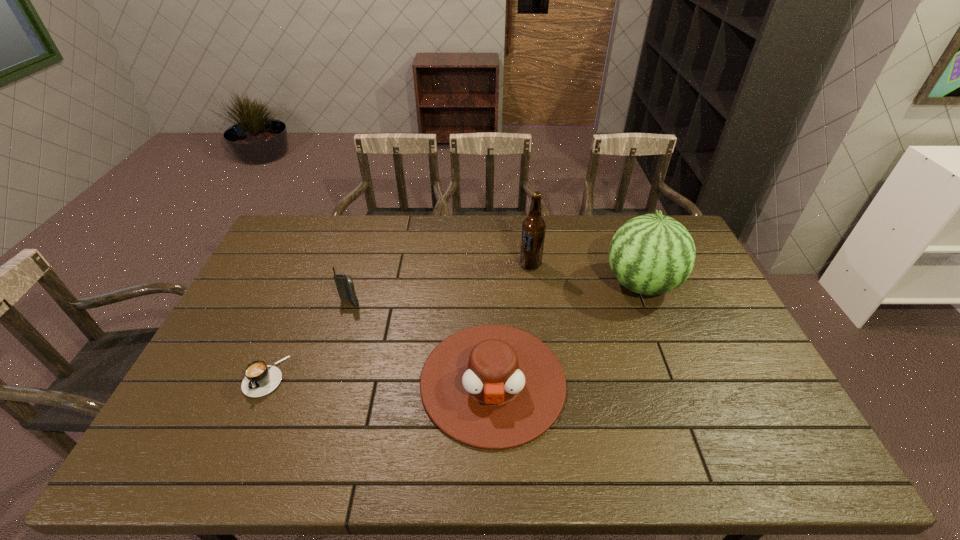
Where is `free region located 0.230m on the left of the rightmost object`? This screenshot has height=540, width=960. free region located 0.230m on the left of the rightmost object is located at coordinates (533, 285).

This screenshot has width=960, height=540. I want to click on vacant area located on the keyboard of the third shortest object, so click(x=328, y=375).

Locate an element on the screen. vacant space situated 0.110m with the handle on the side of the leftmost object is located at coordinates pos(238,439).

Where is `object that is at the near edge`? object that is at the near edge is located at coordinates (494, 387).

You are a GUI agent. You are given a task and a screenshot of the screen. Output one action in this format:
    pyautogui.click(x=<x>, y=<y>)
    Task: Click on the object positioned at the left edge
    The height and width of the screenshot is (540, 960).
    Given the screenshot: What is the action you would take?
    pyautogui.click(x=260, y=379)

Identify the location of object that is at the right edge. (652, 254).

This screenshot has height=540, width=960. In the image, there is a desktop. Find the location of `free space at the far edge`. free space at the far edge is located at coordinates (607, 230).

In the image, there is a desktop. What are the coordinates of `vacant space at the near edge` in the screenshot? It's located at (552, 446).

Where is `free space at the left edge of the desktop`? This screenshot has width=960, height=540. free space at the left edge of the desktop is located at coordinates (300, 257).

Locate an element on the screen. This screenshot has width=960, height=540. vacant space at the right edge of the desktop is located at coordinates (773, 392).